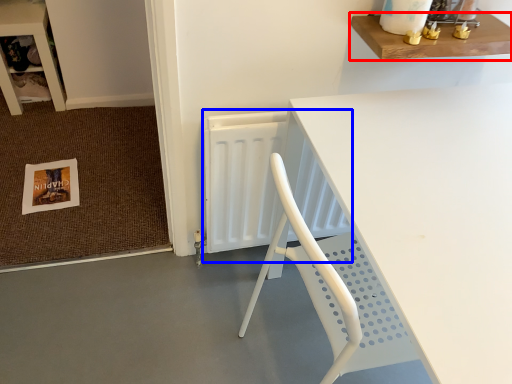
Question: Which object is further to the camera taking this photo, shelf (highlighted by a red box) or radiator (highlighted by a blue box)?

Choices:
 (A) shelf
 (B) radiator

Answer: (B)